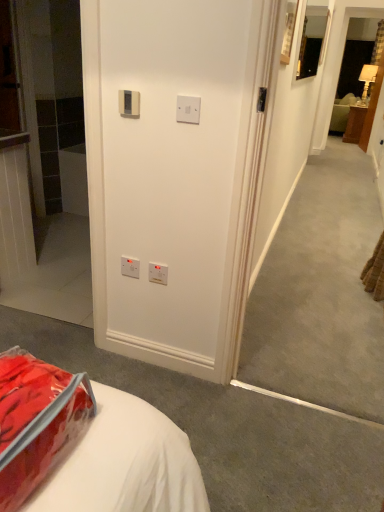
Question: Is white plastic electric outlet at lower center, the 4th electric outlet in the front-to-back sequence, beside translucent plastic bag at lower left?

Choices:
 (A) yes
 (B) no

Answer: (B)

Question: Considering the relative sizes of white plastic electric outlet at lower center, which is the fourth electric outlet from right to left, and translucent plastic bag at lower left in the image provided, is white plastic electric outlet at lower center, which is the fourth electric outlet from right to left, bigger than translucent plastic bag at lower left?

Choices:
 (A) no
 (B) yes

Answer: (A)

Question: Does white plastic electric outlet at lower center, positioned as the first electric outlet in back-to-front order, have a lesser height compared to translucent plastic bag at lower left?

Choices:
 (A) yes
 (B) no

Answer: (A)

Question: Is white plastic electric outlet at lower center, marked as the third electric outlet in a top-to-bottom arrangement, at the left side of translucent plastic bag at lower left?

Choices:
 (A) yes
 (B) no

Answer: (B)

Question: Is translucent plastic bag at lower left located within white plastic electric outlet at lower center, marked as the third electric outlet in a top-to-bottom arrangement?

Choices:
 (A) yes
 (B) no

Answer: (B)

Question: Do you think white plastic electric outlet at lower center, positioned as the first electric outlet in back-to-front order, is within beige plastic thermostat at upper center, which is the third electric outlet in right-to-left order, or outside of it?

Choices:
 (A) outside
 (B) inside

Answer: (A)

Question: In the image, is white plastic electric outlet at lower center, marked as the third electric outlet in a top-to-bottom arrangement, positioned in front of or behind beige plastic thermostat at upper center, which is the 1th electric outlet from top to bottom?

Choices:
 (A) behind
 (B) front

Answer: (A)

Question: Based on their sizes in the image, would you say white plastic electric outlet at lower center, marked as the 2th electric outlet in a bottom-to-top arrangement, is bigger or smaller than beige plastic thermostat at upper center, which is the third electric outlet in right-to-left order?

Choices:
 (A) big
 (B) small

Answer: (B)

Question: From the image's perspective, is white plastic electric outlet at lower center, the 4th electric outlet in the front-to-back sequence, located above or below beige plastic thermostat at upper center, positioned as the 2th electric outlet in left-to-right order?

Choices:
 (A) below
 (B) above

Answer: (A)

Question: From a real-world perspective, is wooden nightstand at right above or below matte black mirror at upper right?

Choices:
 (A) below
 (B) above

Answer: (A)

Question: Relative to matte black mirror at upper right, is wooden nightstand at right in front or behind?

Choices:
 (A) behind
 (B) front

Answer: (A)

Question: Visually, is wooden nightstand at right positioned to the left or to the right of matte black mirror at upper right?

Choices:
 (A) right
 (B) left

Answer: (A)

Question: Based on their sizes in the image, would you say wooden nightstand at right is bigger or smaller than matte black mirror at upper right?

Choices:
 (A) big
 (B) small

Answer: (A)

Question: Considering the positions of point pos(155,279) and point pos(311,67), is point pos(155,279) closer or farther from the camera than point pos(311,67)?

Choices:
 (A) farther
 (B) closer

Answer: (B)

Question: Choose the correct answer: Is white plastic electric outlet at center, which appears as the 2th electric outlet when viewed from the right, inside matte black mirror at upper right or outside it?

Choices:
 (A) outside
 (B) inside

Answer: (A)